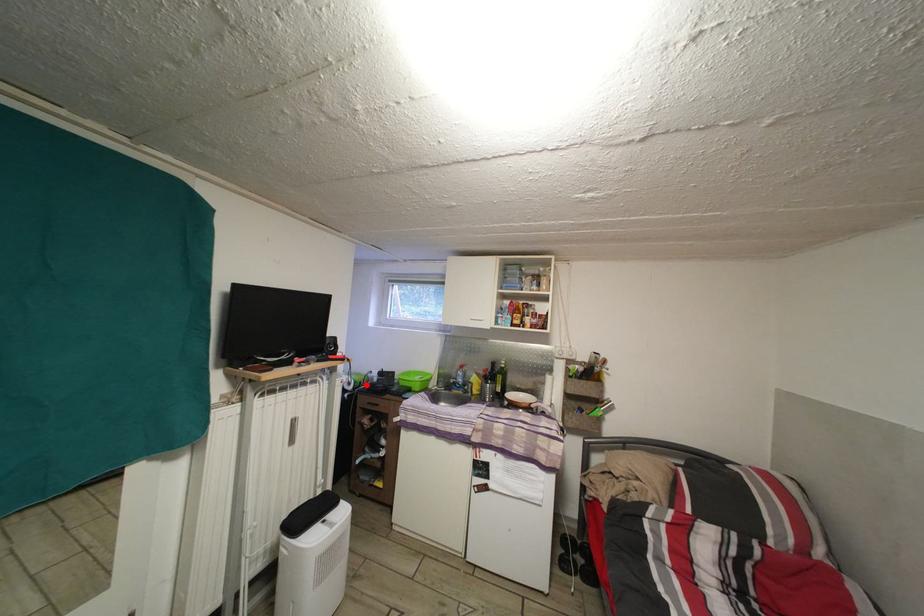
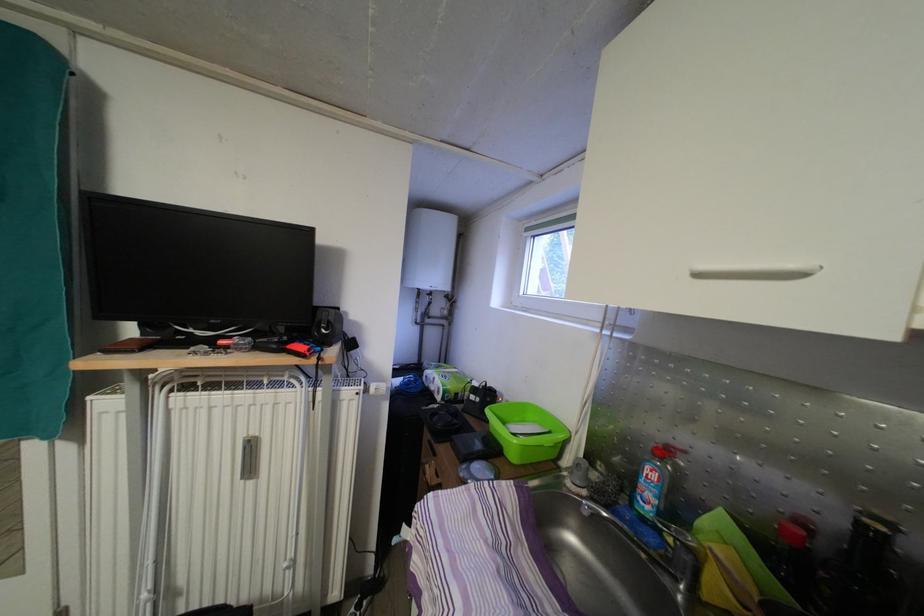
Where in the second image is the point corresponding to the highlighted location from the first image?

(460, 394)